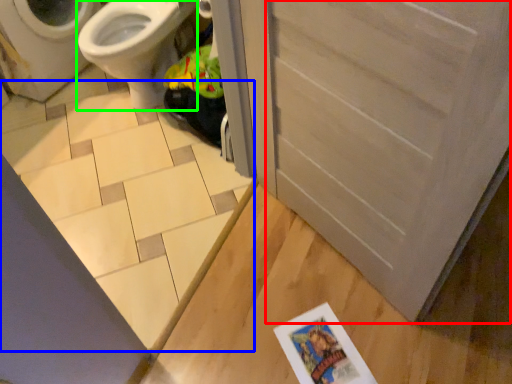
Question: Which object is the farthest from screen door (highlighted by a red box)? Choose among these: tile (highlighted by a blue box) or bidet (highlighted by a green box).

Choices:
 (A) tile
 (B) bidet

Answer: (B)